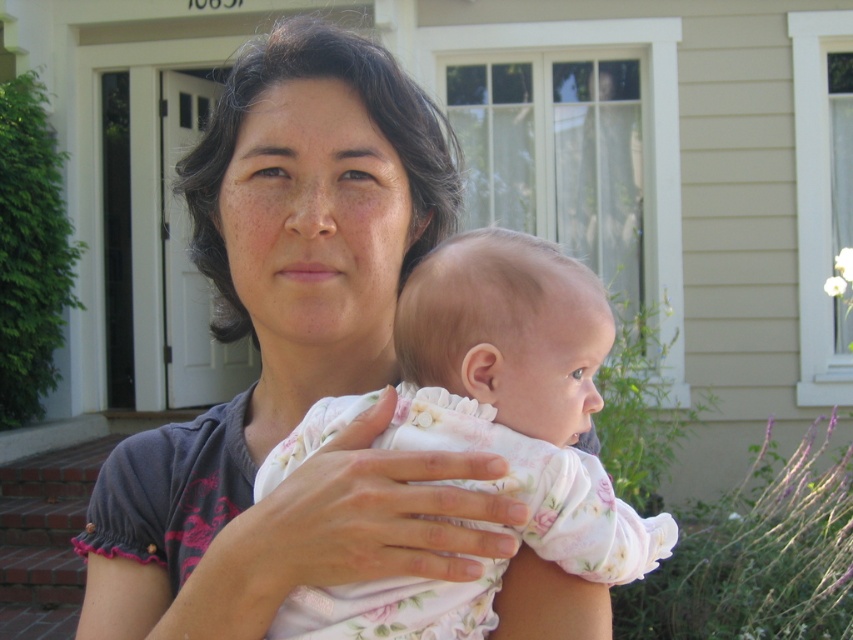
Question: Which of the following is the closest to the observer?

Choices:
 (A) floral cotton baby at center
 (B) matte gray shirt at center

Answer: (B)

Question: Which of the following is the closest to the observer?

Choices:
 (A) (624, 512)
 (B) (225, 410)

Answer: (A)

Question: Does matte gray shirt at center appear over floral cotton baby at center?

Choices:
 (A) no
 (B) yes

Answer: (B)

Question: Does matte gray shirt at center have a larger size compared to floral cotton baby at center?

Choices:
 (A) no
 (B) yes

Answer: (B)

Question: Can you confirm if matte gray shirt at center is wider than floral cotton baby at center?

Choices:
 (A) no
 (B) yes

Answer: (B)